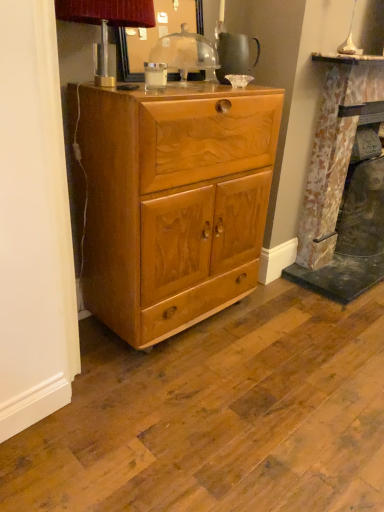
This screenshot has height=512, width=384. Identify the location of metallic silver table lamp at upper left, placed as the first table lamp when sorted from left to right. (106, 22).

What is the approximate width of rustic stone fireplace at right?

rustic stone fireplace at right is 13.16 inches wide.

You are a GUI agent. You are given a task and a screenshot of the screen. Output one action in this format:
    pyautogui.click(x=<x>, y=<y>)
    Task: Click on the metallic silver table lamp at upper left, arranged as the second table lamp when viewed from the right
    The width and height of the screenshot is (384, 512).
    Given the screenshot: What is the action you would take?
    106,22

I want to click on fireplace that is on the right side of glossy wooden mirror at upper center, so click(344, 184).

Is rustic stone fireplace at right taller than glossy wooden mirror at upper center?

Indeed, rustic stone fireplace at right has a greater height compared to glossy wooden mirror at upper center.

In the scene shown: From a real-world perspective, between rustic stone fireplace at right and glossy wooden mirror at upper center, who is vertically lower?

rustic stone fireplace at right.

Looking at this image, are rustic stone fireplace at right and glossy wooden mirror at upper center making contact?

No.

Is matte silver table lamp at upper center, which appears as the second table lamp when viewed from the left, facing away from light brown wood cabinet at center?

That's not correct — matte silver table lamp at upper center, which appears as the second table lamp when viewed from the left, is not looking away from light brown wood cabinet at center.

Can you confirm if matte silver table lamp at upper center, which appears as the second table lamp when viewed from the left, is thinner than light brown wood cabinet at center?

Indeed, matte silver table lamp at upper center, which appears as the second table lamp when viewed from the left, has a lesser width compared to light brown wood cabinet at center.

From the image's perspective, does matte silver table lamp at upper center, which appears as the second table lamp when viewed from the left, appear lower than light brown wood cabinet at center?

No, from the image's perspective, matte silver table lamp at upper center, which appears as the second table lamp when viewed from the left, is not below light brown wood cabinet at center.

Would you say matte silver table lamp at upper center, which appears as the second table lamp when viewed from the left, contains light brown wood cabinet at center?

Actually, light brown wood cabinet at center is outside matte silver table lamp at upper center, which appears as the second table lamp when viewed from the left.

Can light brown wood cabinet at center be found inside rustic stone fireplace at right?

Definitely not — light brown wood cabinet at center is not inside rustic stone fireplace at right.

Considering the sizes of objects rustic stone fireplace at right and light brown wood cabinet at center in the image provided, who is thinner, rustic stone fireplace at right or light brown wood cabinet at center?

rustic stone fireplace at right is thinner.

Considering the points (346, 78) and (182, 125), which point is in front, point (346, 78) or point (182, 125)?

The point (182, 125) is in front.

From a real-world perspective, between metallic silver table lamp at upper left, arranged as the second table lamp when viewed from the right, and light brown wood cabinet at center, who is vertically higher?

From a 3D spatial view, metallic silver table lamp at upper left, arranged as the second table lamp when viewed from the right, is above.

Considering the positions of objects metallic silver table lamp at upper left, arranged as the second table lamp when viewed from the right, and light brown wood cabinet at center in the image provided, who is more to the right, metallic silver table lamp at upper left, arranged as the second table lamp when viewed from the right, or light brown wood cabinet at center?

light brown wood cabinet at center is more to the right.

Could light brown wood cabinet at center be considered to be inside metallic silver table lamp at upper left, placed as the first table lamp when sorted from left to right?

Definitely not — light brown wood cabinet at center is not inside metallic silver table lamp at upper left, placed as the first table lamp when sorted from left to right.

How many degrees apart are the facing directions of metallic silver table lamp at upper left, placed as the first table lamp when sorted from left to right, and light brown wood cabinet at center?

0.452 degrees.

Is light brown wood cabinet at center positioned with its back to rustic stone fireplace at right?

No.

From a real-world perspective, is light brown wood cabinet at center on rustic stone fireplace at right?

No, from a real-world perspective, light brown wood cabinet at center is not on top of rustic stone fireplace at right.

In the image, there is a light brown wood cabinet at center. Where is `fireplace above it (from the image's perspective)`? This screenshot has width=384, height=512. fireplace above it (from the image's perspective) is located at coordinates (344, 184).

The image size is (384, 512). What are the coordinates of `table lamp that is the 1st object located above the rustic stone fireplace at right (from the image's perspective)` in the screenshot? It's located at (106, 22).

Can you tell me how much metallic silver table lamp at upper left, placed as the first table lamp when sorted from left to right, and rustic stone fireplace at right differ in facing direction?

They differ by 0.666 degrees in their facing directions.

Is point (73, 50) closer or farther from the camera than point (357, 231)?

Point (73, 50) is positioned closer to the camera compared to point (357, 231).

Is metallic silver table lamp at upper left, placed as the first table lamp when sorted from left to right, taller than rustic stone fireplace at right?

Incorrect, the height of metallic silver table lamp at upper left, placed as the first table lamp when sorted from left to right, is not larger of that of rustic stone fireplace at right.

Considering the relative sizes of glossy wooden mirror at upper center and light brown wood cabinet at center in the image provided, is glossy wooden mirror at upper center shorter than light brown wood cabinet at center?

Correct, glossy wooden mirror at upper center is not as tall as light brown wood cabinet at center.

From a real-world perspective, does glossy wooden mirror at upper center sit lower than light brown wood cabinet at center?

Actually, glossy wooden mirror at upper center is physically above light brown wood cabinet at center in the real world.

Which point is more forward, [136,78] or [224,230]?

Point [136,78]

Is the position of glossy wooden mirror at upper center less distant than that of light brown wood cabinet at center?

No, glossy wooden mirror at upper center is further to the viewer.

You are a GUI agent. You are given a task and a screenshot of the screen. Output one action in this format:
    pyautogui.click(x=<x>, y=<y>)
    Task: Click on the fireplace below the glossy wooden mirror at upper center (from a real-world perspective)
    
    Given the screenshot: What is the action you would take?
    pyautogui.click(x=344, y=184)

Locate an element on the screen. The width and height of the screenshot is (384, 512). table lamp that is the 2nd one when counting upward from the light brown wood cabinet at center (from the image's perspective) is located at coordinates (186, 53).

Looking at the image, which one is located closer to light brown wood cabinet at center, matte silver table lamp at upper center, which appears as the second table lamp when viewed from the left, or rustic stone fireplace at right?

matte silver table lamp at upper center, which appears as the second table lamp when viewed from the left, lies closer to light brown wood cabinet at center than the other object.

Looking at the image, which one is located closer to light brown wood cabinet at center, rustic stone fireplace at right or matte silver table lamp at upper center, arranged as the first table lamp when viewed from the right?

The object closer to light brown wood cabinet at center is matte silver table lamp at upper center, arranged as the first table lamp when viewed from the right.

Which object lies further to the anchor point matte silver table lamp at upper center, arranged as the first table lamp when viewed from the right, rustic stone fireplace at right or light brown wood cabinet at center?

Based on the image, rustic stone fireplace at right appears to be further to matte silver table lamp at upper center, arranged as the first table lamp when viewed from the right.

Estimate the real-world distances between objects in this image. Which object is further from rustic stone fireplace at right, matte silver table lamp at upper center, arranged as the first table lamp when viewed from the right, or light brown wood cabinet at center?

matte silver table lamp at upper center, arranged as the first table lamp when viewed from the right, is positioned further to the anchor rustic stone fireplace at right.

In the scene shown: From the image, which object appears to be nearer to light brown wood cabinet at center, matte silver table lamp at upper center, which appears as the second table lamp when viewed from the left, or glossy wooden mirror at upper center?

The object closer to light brown wood cabinet at center is glossy wooden mirror at upper center.

When comparing their distances from glossy wooden mirror at upper center, does rustic stone fireplace at right or light brown wood cabinet at center seem closer?

The object closer to glossy wooden mirror at upper center is light brown wood cabinet at center.

Looking at the image, which one is located closer to rustic stone fireplace at right, metallic silver table lamp at upper left, arranged as the second table lamp when viewed from the right, or matte silver table lamp at upper center, which appears as the second table lamp when viewed from the left?

matte silver table lamp at upper center, which appears as the second table lamp when viewed from the left, is positioned closer to the anchor rustic stone fireplace at right.

Estimate the real-world distances between objects in this image. Which object is closer to metallic silver table lamp at upper left, placed as the first table lamp when sorted from left to right, matte silver table lamp at upper center, arranged as the first table lamp when viewed from the right, or light brown wood cabinet at center?

matte silver table lamp at upper center, arranged as the first table lamp when viewed from the right, lies closer to metallic silver table lamp at upper left, placed as the first table lamp when sorted from left to right, than the other object.

I want to click on table lamp situated between metallic silver table lamp at upper left, placed as the first table lamp when sorted from left to right, and rustic stone fireplace at right from left to right, so coord(186,53).

Where is `chest of drawers between glossy wooden mirror at upper center and rustic stone fireplace at right from left to right`? The width and height of the screenshot is (384, 512). chest of drawers between glossy wooden mirror at upper center and rustic stone fireplace at right from left to right is located at coordinates (170, 202).

Identify the location of table lamp situated between light brown wood cabinet at center and rustic stone fireplace at right from left to right. (186, 53).

You are a GUI agent. You are given a task and a screenshot of the screen. Output one action in this format:
    pyautogui.click(x=<x>, y=<y>)
    Task: Click on the mirror between metallic silver table lamp at upper left, placed as the first table lamp when sorted from left to right, and matte silver table lamp at upper center, arranged as the first table lamp when viewed from the right, from front to back
    This screenshot has width=384, height=512.
    Given the screenshot: What is the action you would take?
    pyautogui.click(x=155, y=36)